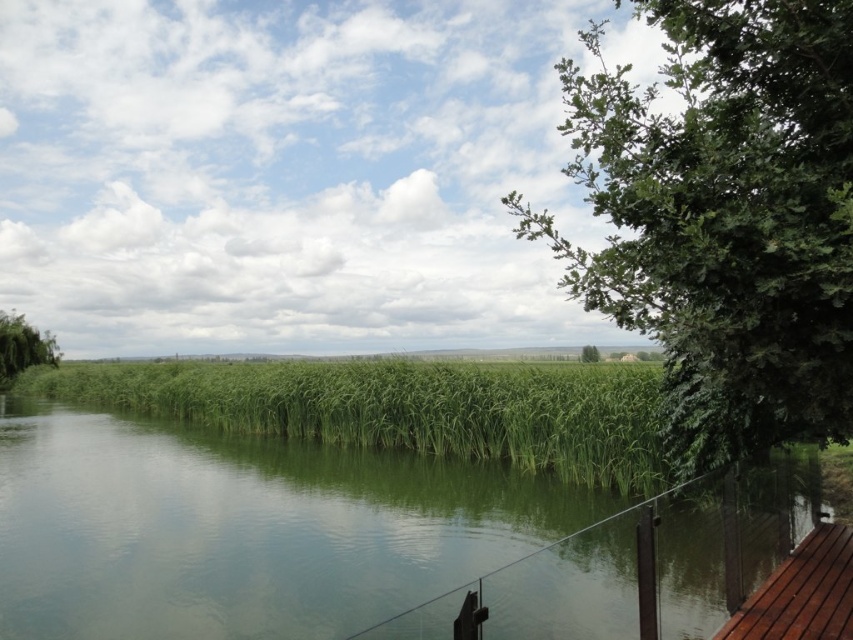
Question: Can you confirm if green grassy river at center is positioned to the right of brown wooden deck at lower right?

Choices:
 (A) yes
 (B) no

Answer: (B)

Question: Is green leafy tree at left below green leafy tree at center?

Choices:
 (A) no
 (B) yes

Answer: (A)

Question: Is brown wooden deck at lower right to the left of green leafy tree at center from the viewer's perspective?

Choices:
 (A) no
 (B) yes

Answer: (B)

Question: Which point is farther to the camera?

Choices:
 (A) (584, 349)
 (B) (811, 634)
 (C) (711, 301)

Answer: (A)

Question: Which object is farther from the camera taking this photo?

Choices:
 (A) green grassy reed at center
 (B) green leafy tree at center
 (C) green leafy tree at right

Answer: (B)

Question: Among these points, which one is farthest from the camera?

Choices:
 (A) (405, 508)
 (B) (637, 204)

Answer: (A)